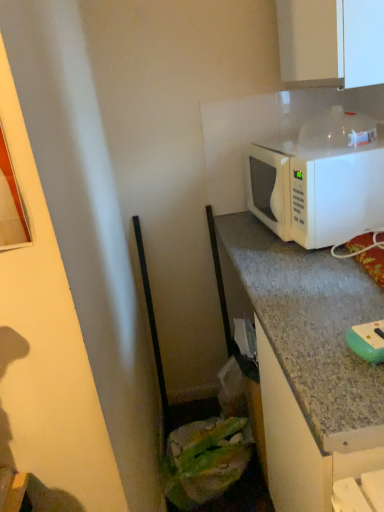
Measure the distance between point (358, 341) and camera.

The distance of point (358, 341) from camera is 31.77 inches.

The image size is (384, 512). What are the coordinates of `green rubber sponge at lower right` in the screenshot? It's located at (367, 341).

Identify the location of green rubber sponge at lower right. The width and height of the screenshot is (384, 512). (367, 341).

Is point (356, 119) positioned in front of point (341, 11)?

No, (356, 119) is behind (341, 11).

Is white matte microwave at upper right next to white glossy cabinet at upper right and touching it?

There is a gap between white matte microwave at upper right and white glossy cabinet at upper right.

Which object is positioned more to the right, white matte microwave at upper right or white glossy cabinet at upper right?

Positioned to the right is white glossy cabinet at upper right.

How different are the orientations of white matte microwave at upper right and white glossy cabinet at upper right in degrees?

The facing directions of white matte microwave at upper right and white glossy cabinet at upper right are 7.67 degrees apart.

How many degrees apart are the facing directions of white glossy cabinet at upper right and green rubber sponge at lower right?

There is a 3.9-degree angle between the facing directions of white glossy cabinet at upper right and green rubber sponge at lower right.

From the image's perspective, is white glossy cabinet at upper right beneath green rubber sponge at lower right?

Incorrect, from the image's perspective, white glossy cabinet at upper right is higher than green rubber sponge at lower right.

Between white glossy cabinet at upper right and green rubber sponge at lower right, which one has larger size?

white glossy cabinet at upper right is bigger.

Is green rubber sponge at lower right turned away from white glossy cabinet at upper right?

No, green rubber sponge at lower right is not facing away from white glossy cabinet at upper right.

Measure the distance between green rubber sponge at lower right and white glossy cabinet at upper right.

They are 78.31 centimeters apart.

How many degrees apart are the facing directions of green rubber sponge at lower right and white glossy cabinet at upper right?

The facing directions of green rubber sponge at lower right and white glossy cabinet at upper right are 3.9 degrees apart.

Which is nearer, (373, 339) or (331, 24)?

Clearly, point (373, 339) is closer to the camera than point (331, 24).

Between white matte microwave at upper right and green rubber sponge at lower right, which one is positioned behind?

white matte microwave at upper right is further from the camera.

Which of these two, white matte microwave at upper right or green rubber sponge at lower right, is thinner?

white matte microwave at upper right is thinner.

Does point (360, 125) come behind point (376, 333)?

Yes, it is behind point (376, 333).

How far apart are white glossy cabinet at upper right and white matte microwave at upper right?

The distance of white glossy cabinet at upper right from white matte microwave at upper right is 31.58 centimeters.

Considering the relative sizes of white glossy cabinet at upper right and white matte microwave at upper right in the image provided, is white glossy cabinet at upper right wider than white matte microwave at upper right?

No.

Does point (308, 4) appear closer or farther from the camera than point (337, 205)?

Point (308, 4) appears to be closer to the viewer than point (337, 205).

Is white glossy cabinet at upper right far from white matte microwave at upper right?

No, white glossy cabinet at upper right is not far away from white matte microwave at upper right.

Is green rubber sponge at lower right facing towards white matte microwave at upper right?

No, green rubber sponge at lower right is not oriented towards white matte microwave at upper right.

Who is taller, green rubber sponge at lower right or white matte microwave at upper right?

With more height is white matte microwave at upper right.

Considering the positions of objects green rubber sponge at lower right and white matte microwave at upper right in the image provided, who is more to the left, green rubber sponge at lower right or white matte microwave at upper right?

From the viewer's perspective, white matte microwave at upper right appears more on the left side.

Locate an element on the screen. The width and height of the screenshot is (384, 512). microwave oven behind the white glossy cabinet at upper right is located at coordinates 319,181.

Identify the location of appliance that appears below the white glossy cabinet at upper right (from the image's perspective). (367, 341).

Based on their spatial positions, is white glossy cabinet at upper right or green rubber sponge at lower right closer to white matte microwave at upper right?

white glossy cabinet at upper right lies closer to white matte microwave at upper right than the other object.

Based on the photo, based on their spatial positions, is green rubber sponge at lower right or white glossy cabinet at upper right further from white matte microwave at upper right?

The object further to white matte microwave at upper right is green rubber sponge at lower right.

Estimate the real-world distances between objects in this image. Which object is closer to green rubber sponge at lower right, white matte microwave at upper right or white glossy cabinet at upper right?

Based on the image, white matte microwave at upper right appears to be nearer to green rubber sponge at lower right.

Looking at the image, which one is located further to white glossy cabinet at upper right, green rubber sponge at lower right or white matte microwave at upper right?

Based on the image, green rubber sponge at lower right appears to be further to white glossy cabinet at upper right.

When comparing their distances from green rubber sponge at lower right, does white glossy cabinet at upper right or white matte microwave at upper right seem further?

Among the two, white glossy cabinet at upper right is located further to green rubber sponge at lower right.

From the image, which object appears to be farther from white glossy cabinet at upper right, white matte microwave at upper right or green rubber sponge at lower right?

green rubber sponge at lower right lies further to white glossy cabinet at upper right than the other object.

The image size is (384, 512). Identify the location of microwave oven between white glossy cabinet at upper right and green rubber sponge at lower right in the vertical direction. (319, 181).